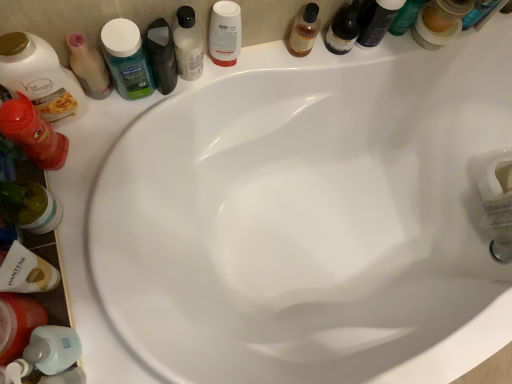
Question: Do you think white matte shampoo bottle at lower left, which appears as the 3th toiletry when viewed from the left, is within rubberized red bottle at left, acting as the eighth toiletry starting from the right, or outside of it?

Choices:
 (A) inside
 (B) outside

Answer: (B)

Question: Is white matte shampoo bottle at lower left, which appears as the 3th toiletry when viewed from the left, to the left or to the right of rubberized red bottle at left, acting as the eighth toiletry starting from the right, in the image?

Choices:
 (A) left
 (B) right

Answer: (B)

Question: Which object is the farthest from the translucent plastic mouthwash at lower left, placed as the sixth mouthwash when sorted from right to left?

Choices:
 (A) white glossy mouthwash at upper center, the second mouthwash from the top
 (B) matte black bag at upper center, acting as the fifth toiletry starting from the left
 (C) matte black bottle at upper right, the 1th toiletry positioned from the right
 (D) translucent amber bottle at upper center, placed as the third toiletry when sorted from right to left
 (E) translucent plastic mouthwash at upper right, which appears as the first mouthwash when viewed from the right

Answer: (E)

Question: Considering the real-world distances, which object is closest to the translucent plastic mouthwash at left, placed as the second mouthwash when sorted from bottom to top?

Choices:
 (A) white matte shampoo bottle at lower left, which appears as the 3th toiletry when viewed from the left
 (B) matte black bag at upper center, acting as the fifth toiletry starting from the left
 (C) translucent plastic pump bottle at lower left, which is counted as the 4th toiletry, starting from the left
 (D) green matte bottle at upper right
 (E) rubberized red bottle at left, placed as the first toiletry when sorted from left to right

Answer: (B)